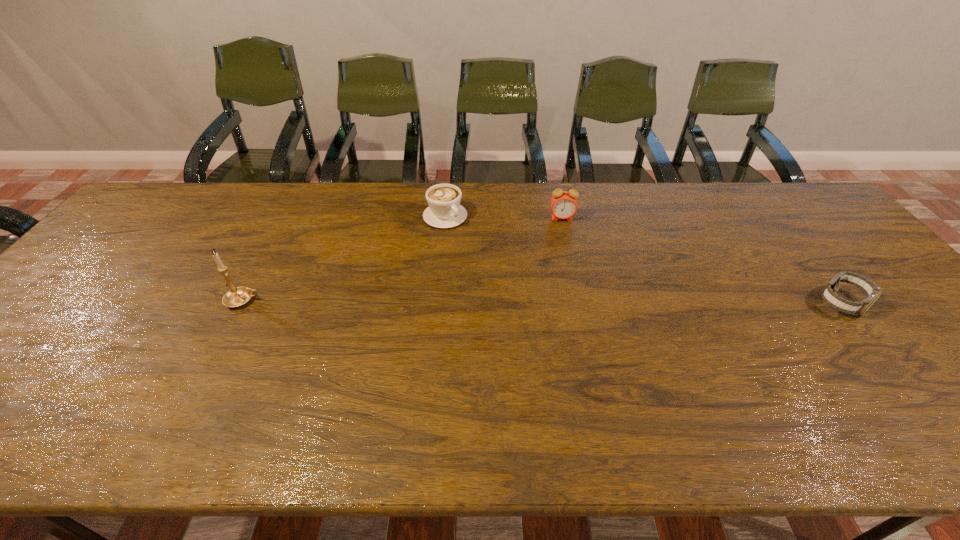
This screenshot has width=960, height=540. In order to click on vacant region between the tallest object and the third object from right to left in this screenshot , I will do `click(345, 258)`.

Locate an element on the screen. vacant area that lies between the watch and the alarm clock is located at coordinates (702, 261).

Where is `the second closest object to the watch`? This screenshot has height=540, width=960. the second closest object to the watch is located at coordinates (444, 211).

The image size is (960, 540). In order to click on object that is the closest to the tallest object in this screenshot , I will do `click(444, 211)`.

The height and width of the screenshot is (540, 960). What are the coordinates of `vacant area that satisfies the following two spatial constraints: 1. on the front side of the cappuccino; 2. on the face of the watch` in the screenshot? It's located at pos(437,303).

This screenshot has width=960, height=540. Find the location of `vacant space that satisfies the following two spatial constraints: 1. on the front side of the watch; 2. on the face of the cappuccino`. vacant space that satisfies the following two spatial constraints: 1. on the front side of the watch; 2. on the face of the cappuccino is located at coordinates (437, 303).